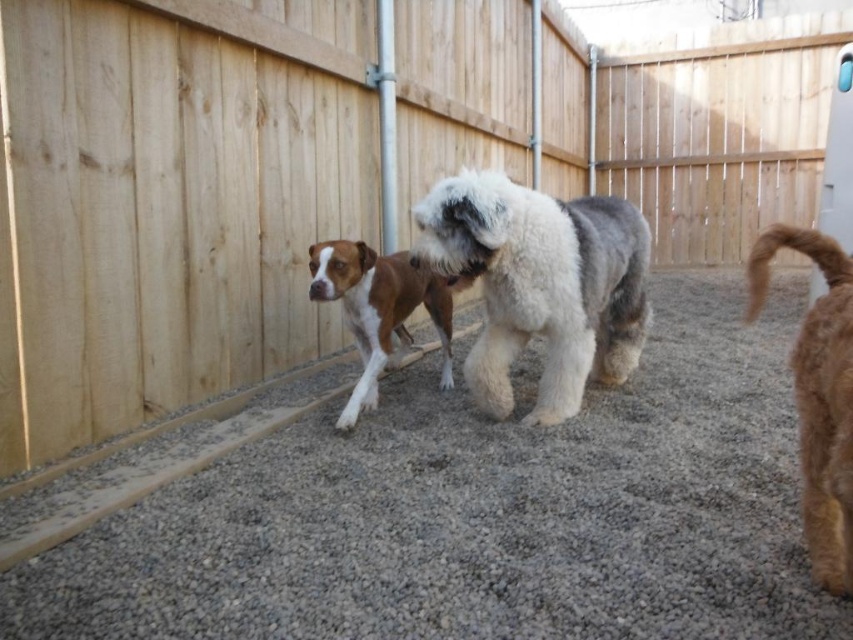
Consider the image. Does brown furry tail at right appear over brown/white fur dog at center?

Incorrect, brown furry tail at right is not positioned above brown/white fur dog at center.

Is brown furry tail at right wider than brown/white fur dog at center?

Incorrect, brown furry tail at right's width does not surpass brown/white fur dog at center's.

The height and width of the screenshot is (640, 853). I want to click on brown furry tail at right, so click(817, 396).

Which is in front, point (398, 502) or point (579, 330)?

Positioned in front is point (398, 502).

The image size is (853, 640). Describe the element at coordinates (482, 513) in the screenshot. I see `gray gravel at center` at that location.

I want to click on gray gravel at center, so click(x=482, y=513).

Between gray gravel at center and brown furry tail at right, which one appears on the left side from the viewer's perspective?

gray gravel at center is more to the left.

Is point (802, 557) closer to viewer compared to point (815, 472)?

No, (802, 557) is behind (815, 472).

This screenshot has height=640, width=853. In order to click on gray gravel at center in this screenshot , I will do `click(482, 513)`.